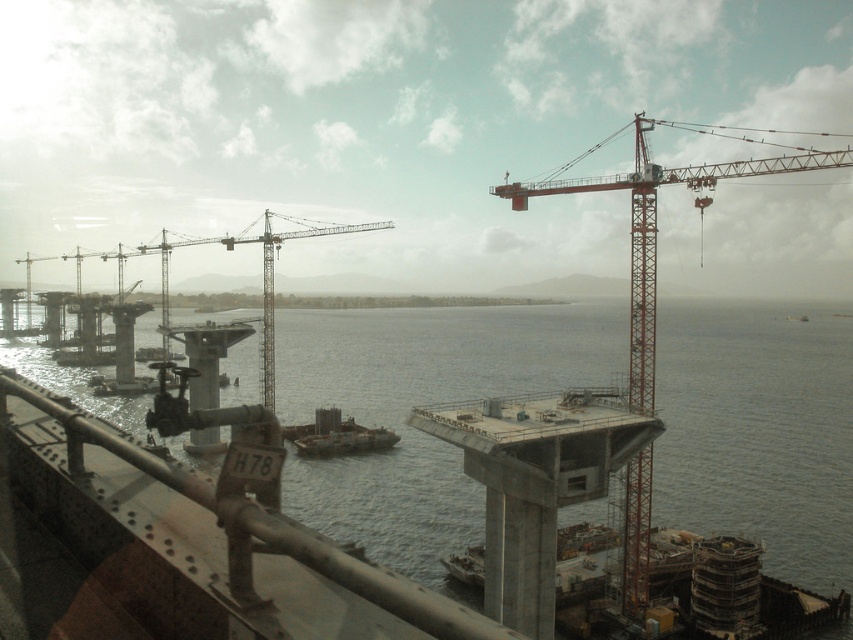
Based on the photo, you are an engineer inspecting the construction site. You need to determine if the rusty metal rail at lower left can be seen over the metallic gray boat at center from your current vantage point. Based on their heights, what is your assessment?

The rusty metal rail at lower left is taller than the metallic gray boat at center, so yes, the engineer can see the rusty metal rail at lower left over the metallic gray boat at center from the current vantage point.

You are a surveyor standing at the construction site. You need to determine the distance between two points marked in the image. The first point is at coordinates point (x=347, y=333) and the second is at point (x=643, y=576). Given that the distance between these two points is 20 meters, and you are closer to the first point, which point is nearer to you?

Point (x=347, y=333) is further to the camera than point (x=643, y=576). However, since you are a surveyor standing at the construction site and closer to the first point, the first point is nearer to you.

You are a safety inspector on the construction site. You notice the metallic gray crane at center and the metallic gray boat at center. Which object is located above the other?

The metallic gray crane at center is positioned over metallic gray boat at center, meaning the crane is above the boat.